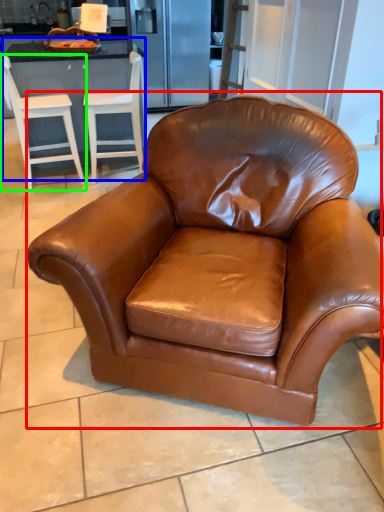
Question: Based on their relative distances, which object is nearer to chair (highlighted by a red box)? Choose from dresser (highlighted by a blue box) and chair (highlighted by a green box).

Choices:
 (A) dresser
 (B) chair

Answer: (A)